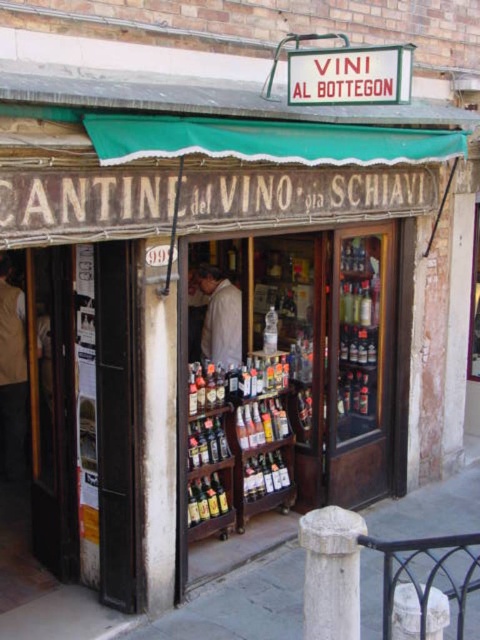
Question: Estimate the real-world distances between objects in this image. Which object is closer to the white stone post at center?

Choices:
 (A) gray concrete pavement at lower center
 (B) light beige shirt at center
 (C) white stone pillar at center

Answer: (C)

Question: Is light beige shirt at center positioned in front of white stone pillar at center?

Choices:
 (A) no
 (B) yes

Answer: (A)

Question: Based on their relative distances, which object is nearer to the light beige shirt at center?

Choices:
 (A) white stone pillar at center
 (B) white stone post at center
 (C) gray concrete pavement at lower center
 (D) light beige vest at left

Answer: (D)

Question: Can you confirm if white stone post at center is positioned to the left of light beige vest at left?

Choices:
 (A) yes
 (B) no

Answer: (B)

Question: From the image, what is the correct spatial relationship of gray concrete pavement at lower center in relation to light beige shirt at center?

Choices:
 (A) above
 (B) below

Answer: (B)

Question: Based on their relative distances, which object is nearer to the white stone post at center?

Choices:
 (A) gray concrete pavement at lower center
 (B) white stone pillar at center

Answer: (B)